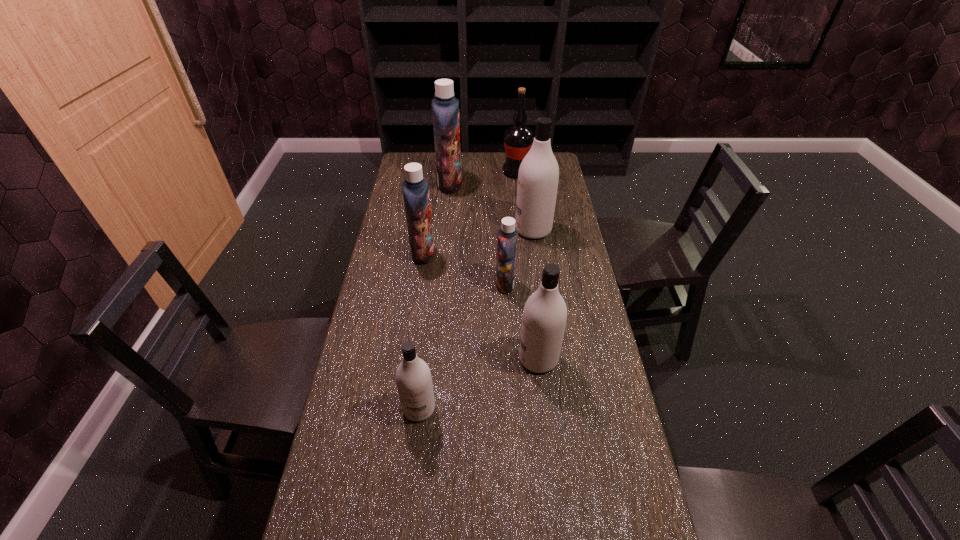
At what (x,y) coordinates should I click in order to perform the action: click on the smallest white shampoo. Please return your answer as a coordinate pair (x, y). The height and width of the screenshot is (540, 960). Looking at the image, I should click on (414, 383).

The width and height of the screenshot is (960, 540). In order to click on vacant space located 0.290m on the front-facing side of the farthest white shampoo in this screenshot , I will do `click(441, 230)`.

You are a GUI agent. You are given a task and a screenshot of the screen. Output one action in this format:
    pyautogui.click(x=<x>, y=<y>)
    Task: Click on the vacant space located on the front-facing side of the farthest white shampoo
    The image size is (960, 540).
    Given the screenshot: What is the action you would take?
    pyautogui.click(x=489, y=230)

Locate an element on the screen. This screenshot has width=960, height=540. blank space located on the front-facing side of the farthest white shampoo is located at coordinates (484, 230).

The width and height of the screenshot is (960, 540). Identify the location of vacant area situated 0.270m on the front label of the farthest shampoo. (522, 184).

You are a GUI agent. You are given a task and a screenshot of the screen. Output one action in this format:
    pyautogui.click(x=<x>, y=<y>)
    Task: Click on the free point located 0.120m on the left of the wine bottle
    This screenshot has height=540, width=960.
    Given the screenshot: What is the action you would take?
    pyautogui.click(x=476, y=172)

Image resolution: width=960 pixels, height=540 pixels. Identify the location of vacant space positioned 0.080m on the front label of the second farthest blue shampoo. (456, 253).

The image size is (960, 540). I want to click on vacant space located on the front-facing side of the second biggest white shampoo, so coord(386,359).

In order to click on free location located on the front-facing side of the second biggest white shampoo in this screenshot , I will do `click(488, 359)`.

Identify the location of free region located 0.370m on the front-facing side of the second biggest white shampoo. (393, 359).